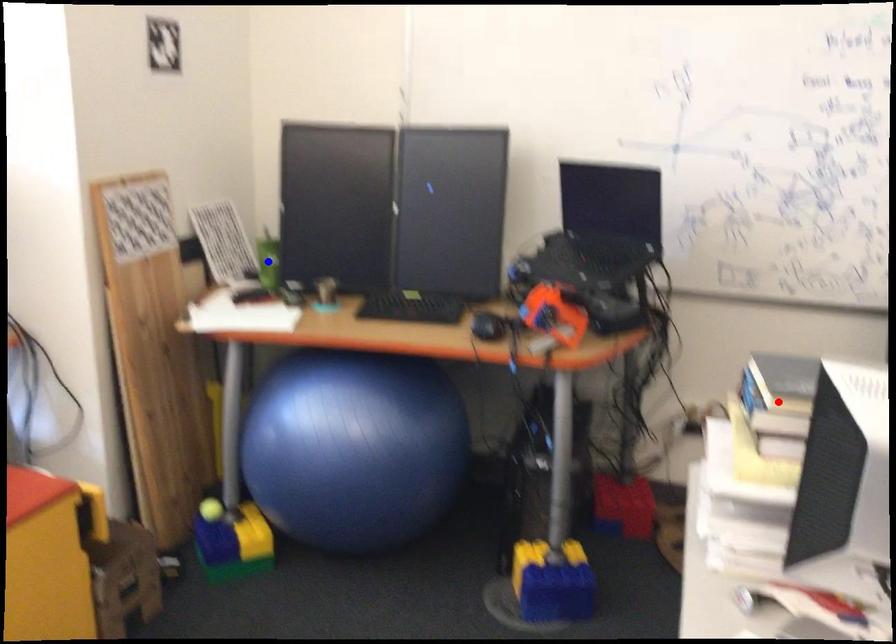
Question: Which of the two points in the image is closer to the camera?

Choices:
 (A) Blue point is closer.
 (B) Red point is closer.

Answer: (B)